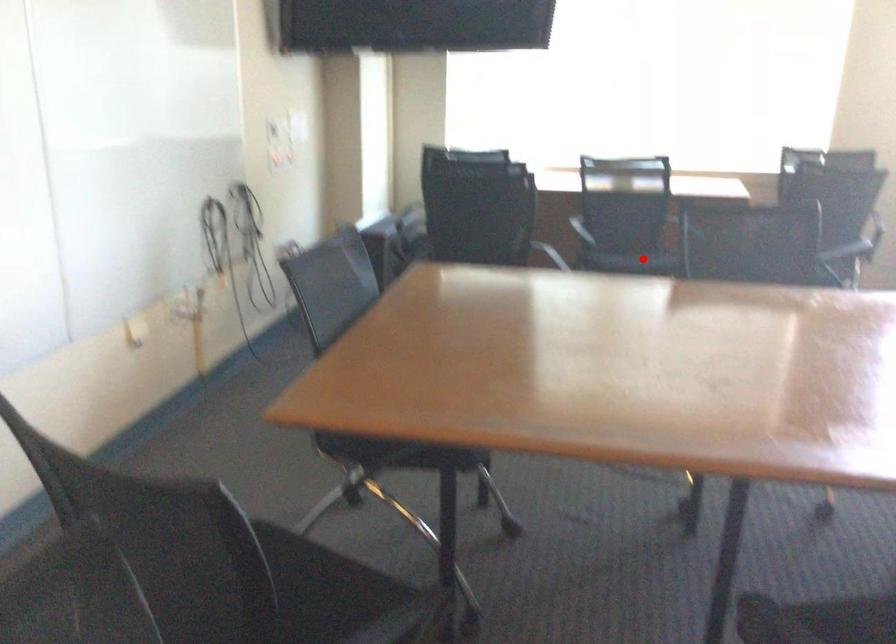
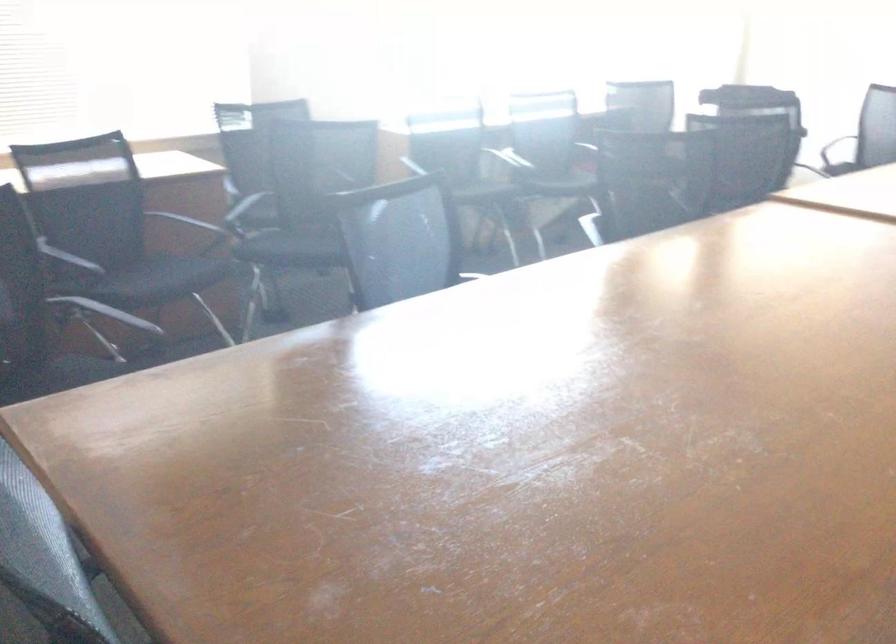
Where in the second image is the point corresponding to the highlighted location from the first image?

(159, 279)